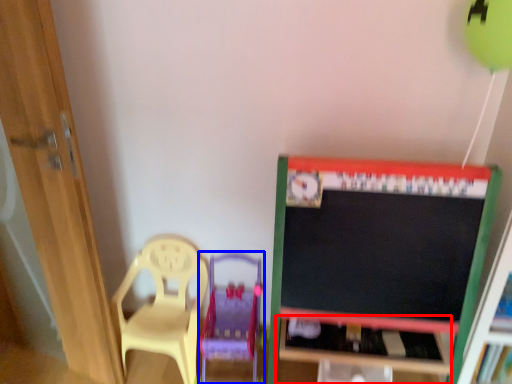
Question: Which point is closer to the camera, table (highlighted by a red box) or swivel chair (highlighted by a blue box)?

Choices:
 (A) table
 (B) swivel chair

Answer: (B)